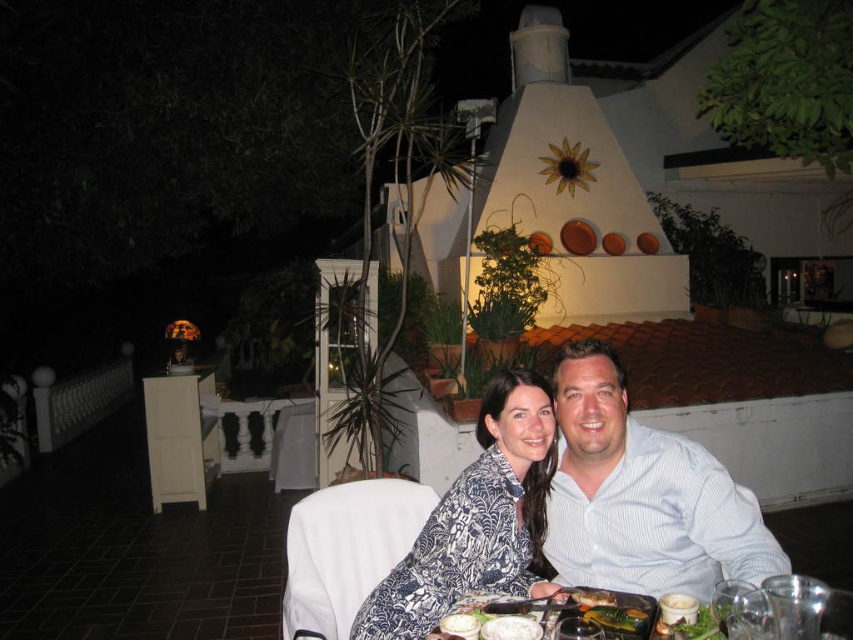
Question: Estimate the real-world distances between objects in this image. Which object is closer to the blue printed dress at center?

Choices:
 (A) white striped shirt at center
 (B) matte glass plate at center
 (C) shiny metallic fork at lower center

Answer: (A)

Question: Is white striped shirt at center above matte glass plate at center?

Choices:
 (A) yes
 (B) no

Answer: (A)

Question: Estimate the real-world distances between objects in this image. Which object is closer to the matte glass plate at center?

Choices:
 (A) blue printed dress at center
 (B) white striped shirt at center

Answer: (A)

Question: Does white striped shirt at center have a lesser width compared to blue printed dress at center?

Choices:
 (A) no
 (B) yes

Answer: (A)

Question: Considering the relative positions of white striped shirt at center and blue printed dress at center in the image provided, where is white striped shirt at center located with respect to blue printed dress at center?

Choices:
 (A) right
 (B) left

Answer: (A)

Question: Which point is farther to the camera?

Choices:
 (A) (576, 588)
 (B) (556, 627)
 (C) (740, 572)
 (D) (422, 593)

Answer: (D)